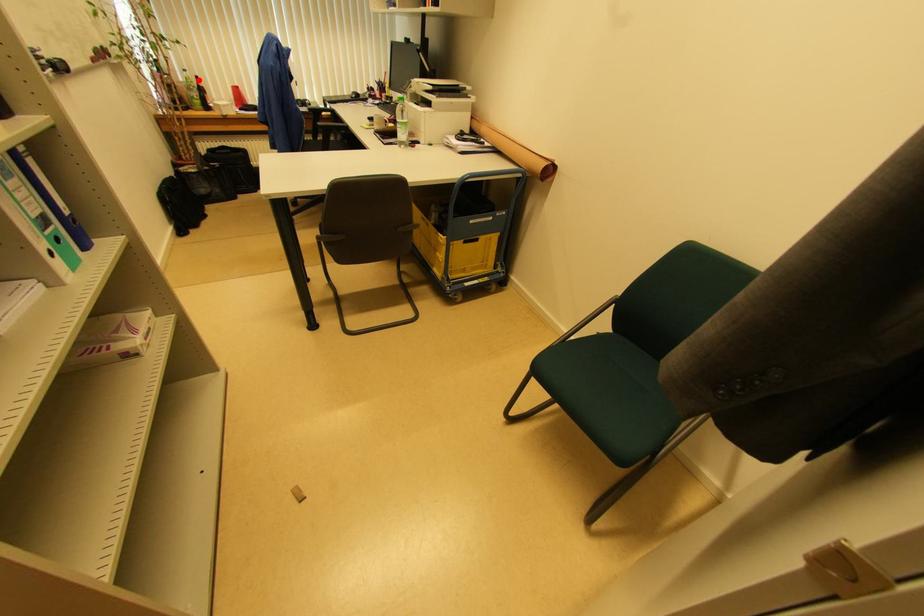
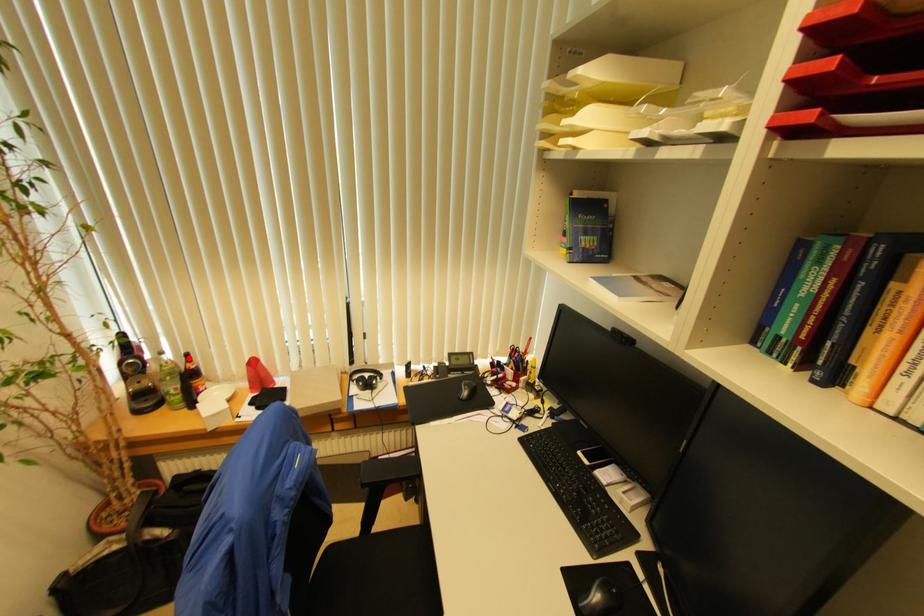
I am providing you with two images of the same scene from different viewpoints. A red point is marked on the first image and another point is marked on the second image. Is the marked point in image1 the same physical position as the marked point in image2?

Yes